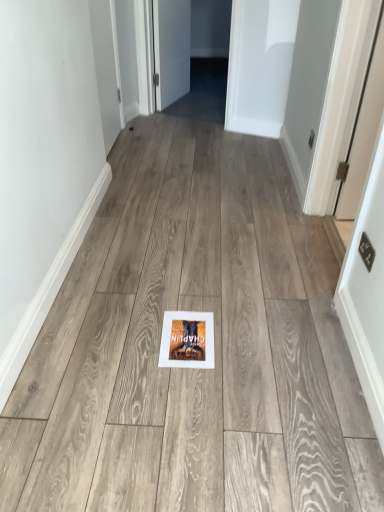
At what (x,y) coordinates should I click in order to perform the action: click on vacant space situated on the left part of matte gold postcard at center. Please return your answer as a coordinate pair (x, y). This screenshot has width=384, height=512. Looking at the image, I should click on (130, 333).